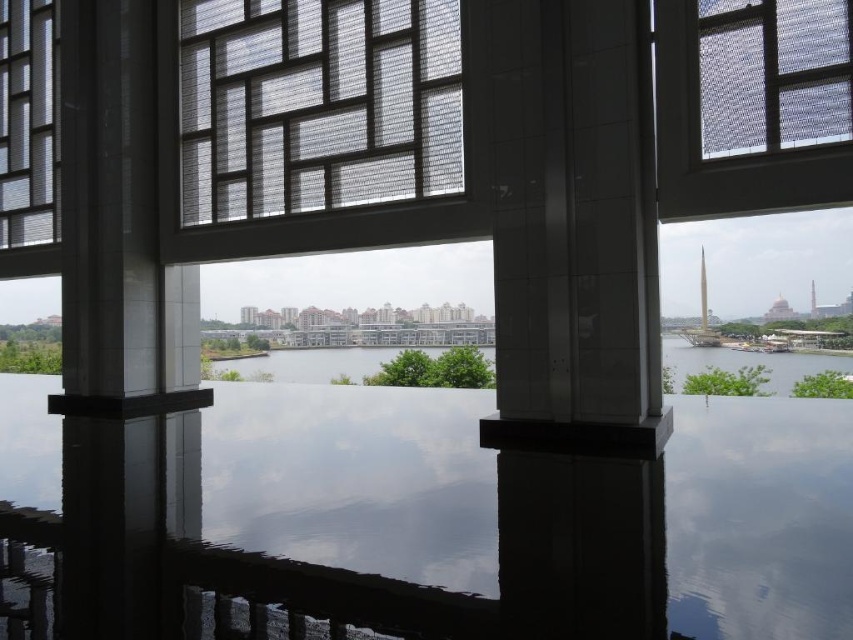
Question: Is translucent mesh screen at upper center wider than translucent glass window at left?

Choices:
 (A) no
 (B) yes

Answer: (A)

Question: Which point is farther to the camera?

Choices:
 (A) translucent glass window at left
 (B) translucent mesh screen at upper center
 (C) translucent mesh window at center

Answer: (A)

Question: Estimate the real-world distances between objects in this image. Which object is farther from the translucent glass window at left?

Choices:
 (A) translucent mesh screen at upper center
 (B) transparent glass water at center

Answer: (B)

Question: Observing the image, what is the correct spatial positioning of translucent mesh window at center in reference to translucent mesh screen at upper center?

Choices:
 (A) below
 (B) above

Answer: (B)

Question: Can you confirm if translucent mesh window at center is positioned above translucent glass window at left?

Choices:
 (A) no
 (B) yes

Answer: (A)

Question: Which point appears farthest from the camera in this image?

Choices:
 (A) (36, 490)
 (B) (764, 120)
 (C) (370, 202)
 (D) (44, 65)

Answer: (D)